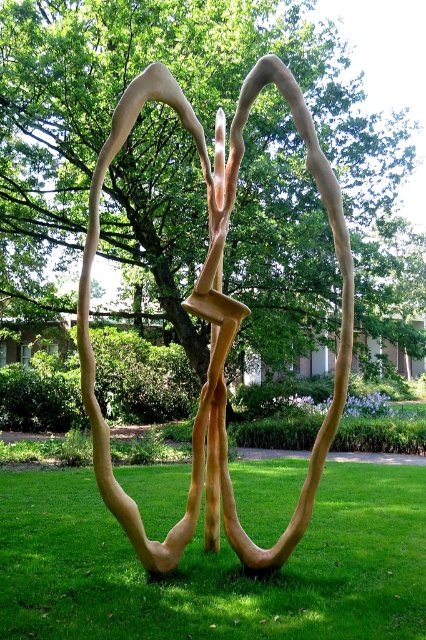
Question: Which object appears closest to the camera in this image?

Choices:
 (A) wooden sculpture at center
 (B) green grass at center
 (C) brown wood tree at center

Answer: (A)

Question: Is brown wood tree at center to the left of wooden sculpture at center from the viewer's perspective?

Choices:
 (A) no
 (B) yes

Answer: (A)

Question: Is green grass at center below wooden sculpture at center?

Choices:
 (A) no
 (B) yes

Answer: (B)

Question: In this image, where is brown wood tree at center located relative to wooden sculpture at center?

Choices:
 (A) below
 (B) above

Answer: (B)

Question: Among these objects, which one is nearest to the camera?

Choices:
 (A) wooden sculpture at center
 (B) green grass at center
 (C) brown wood tree at center

Answer: (A)

Question: Estimate the real-world distances between objects in this image. Which object is farther from the green grass at center?

Choices:
 (A) brown wood tree at center
 (B) wooden sculpture at center

Answer: (A)